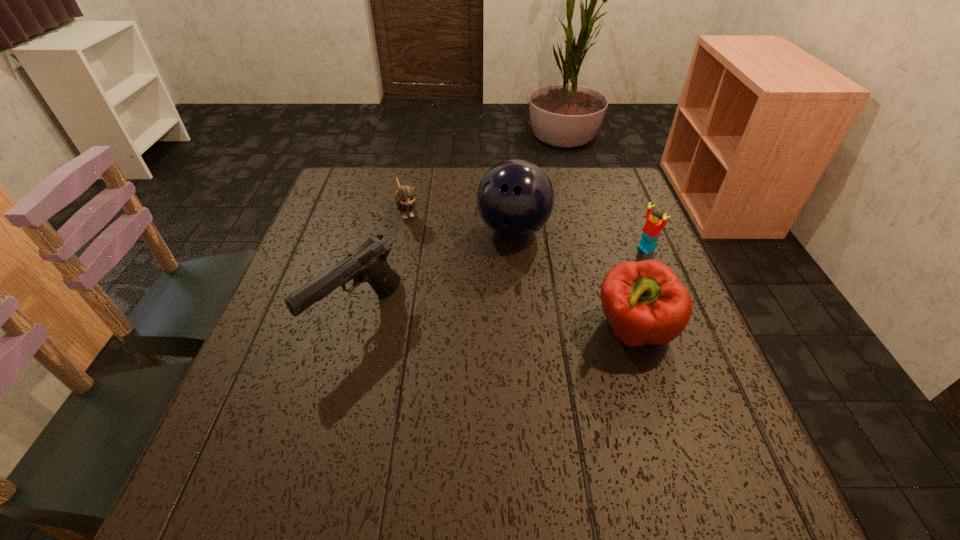
Find the location of a particular element. This screenshot has height=540, width=960. vacant space on the desktop that is between the gun and the bell pepper and is positioned on the face of the Lego is located at coordinates pos(461,321).

Image resolution: width=960 pixels, height=540 pixels. I want to click on vacant space on the desktop that is between the gun and the bell pepper and is positioned on the front-facing side of the kitten, so click(x=456, y=321).

Locate an element on the screen. free space on the desktop that is between the gun and the bell pepper and is positioned on the surface of the third object from left to right near the finger holes is located at coordinates (528, 325).